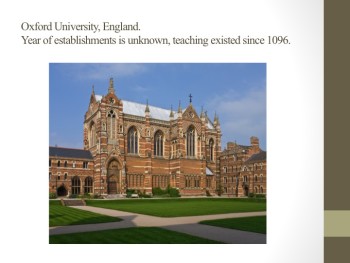
This screenshot has height=263, width=350. Identify the location of windows. tap(134, 138), tap(158, 139), tap(192, 138), tap(134, 177), tap(159, 178), tap(187, 180), tap(195, 180), tap(208, 182), tap(74, 181), tap(88, 183).